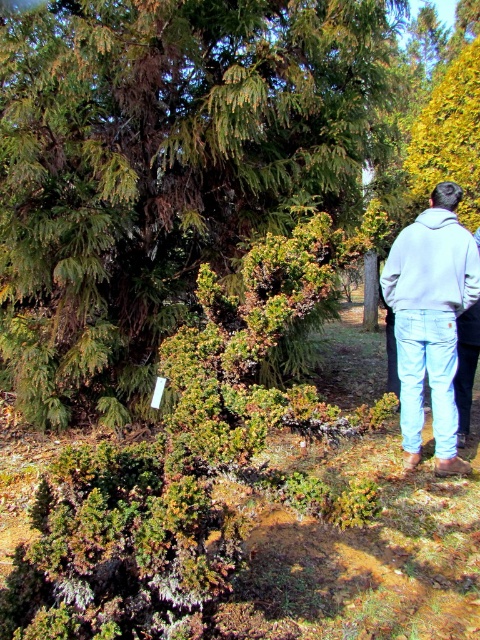
You are a hiker who wants to take a photo of the green leafy tree at upper left and the light gray hoodie at upper right. Which object should you focus on first if you want both to be in focus?

The green leafy tree at upper left is bigger than the light gray hoodie at upper right, so you should focus on the green leafy tree at upper left first to ensure both are in focus.

You are a hiker who has just arrived at this garden area. You need to place your light gray hoodie at upper right somewhere safe and visible. Where would you place it so that it is both visible and secure?

You should place the light gray hoodie at upper right at point (431, 321) as it is the designated spot for such items in this area.